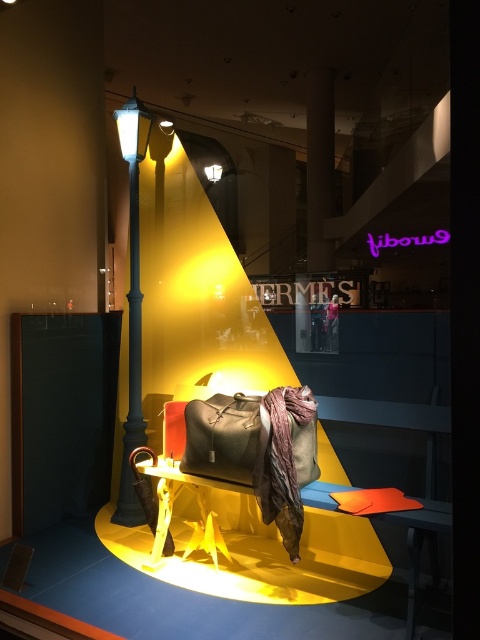
You are a customer standing in front of the retail display. The store has a rule that you must not approach closer than 1 meter to any displayed item. If you are currently standing at point 0.5, 0.5, can you safely observe the leather bag at center without violating the store rule?

The leather bag at center is located at point (226, 436). The distance between your current position at (240, 320) and the bag is approximately 0.2 meters, which is well within the 1 meter minimum distance requirement. Therefore, you are too close and need to step back to comply with the store rule.

Consider the image. You are standing at the entrance of the store and want to locate the metallic blue lamp post at left. According to the store layout, where is it positioned?

The metallic blue lamp post at left is positioned at point (132,305).